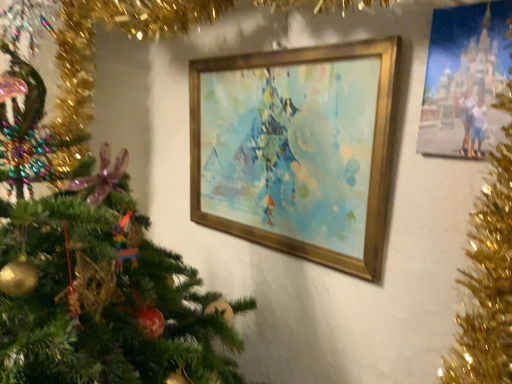
Question: Is the depth of gold metallic picture frame at center, which is the 1th picture frame from left to right, less than that of matte plastic photo frame at upper right, acting as the 1th picture frame starting from the front?

Choices:
 (A) yes
 (B) no

Answer: (B)

Question: From the image's perspective, is gold metallic picture frame at center, the 2th picture frame positioned from the front, on top of matte plastic photo frame at upper right, acting as the 1th picture frame starting from the front?

Choices:
 (A) no
 (B) yes

Answer: (A)

Question: Can you confirm if gold metallic picture frame at center, which is the first picture frame in back-to-front order, is wider than matte plastic photo frame at upper right, acting as the 1th picture frame starting from the front?

Choices:
 (A) no
 (B) yes

Answer: (B)

Question: Is the position of gold metallic picture frame at center, the second picture frame positioned from the right, more distant than that of matte plastic photo frame at upper right, acting as the 1th picture frame starting from the front?

Choices:
 (A) yes
 (B) no

Answer: (A)

Question: Can you confirm if gold metallic picture frame at center, the 2th picture frame positioned from the front, is shorter than matte plastic photo frame at upper right, acting as the 1th picture frame starting from the front?

Choices:
 (A) yes
 (B) no

Answer: (B)

Question: Is gold metallic picture frame at center, the 2th picture frame positioned from the front, facing towards matte plastic photo frame at upper right, which appears as the 2th picture frame when viewed from the back?

Choices:
 (A) yes
 (B) no

Answer: (B)

Question: Could you tell me if matte plastic photo frame at upper right, the 1th picture frame positioned from the right, is turned towards gold metallic picture frame at center, the second picture frame positioned from the right?

Choices:
 (A) yes
 (B) no

Answer: (B)

Question: From a real-world perspective, is matte plastic photo frame at upper right, acting as the 1th picture frame starting from the front, positioned under gold metallic picture frame at center, which is the first picture frame in back-to-front order, based on gravity?

Choices:
 (A) yes
 (B) no

Answer: (B)

Question: Is matte plastic photo frame at upper right, the 1th picture frame positioned from the right, far from gold metallic picture frame at center, which is the first picture frame in back-to-front order?

Choices:
 (A) no
 (B) yes

Answer: (A)

Question: Is matte plastic photo frame at upper right, acting as the 1th picture frame starting from the front, located outside gold metallic picture frame at center, which is the first picture frame in back-to-front order?

Choices:
 (A) no
 (B) yes

Answer: (B)

Question: Considering the relative sizes of matte plastic photo frame at upper right, acting as the 1th picture frame starting from the front, and gold metallic picture frame at center, which is the 1th picture frame from left to right, in the image provided, is matte plastic photo frame at upper right, acting as the 1th picture frame starting from the front, smaller than gold metallic picture frame at center, which is the 1th picture frame from left to right,?

Choices:
 (A) yes
 (B) no

Answer: (A)

Question: From a real-world perspective, is matte plastic photo frame at upper right, the 1th picture frame positioned from the right, on gold metallic picture frame at center, the second picture frame positioned from the right?

Choices:
 (A) no
 (B) yes

Answer: (B)

Question: Visually, is gold metallic picture frame at center, which is the first picture frame in back-to-front order, positioned to the left or to the right of matte plastic photo frame at upper right, the second picture frame in the left-to-right sequence?

Choices:
 (A) right
 (B) left

Answer: (B)